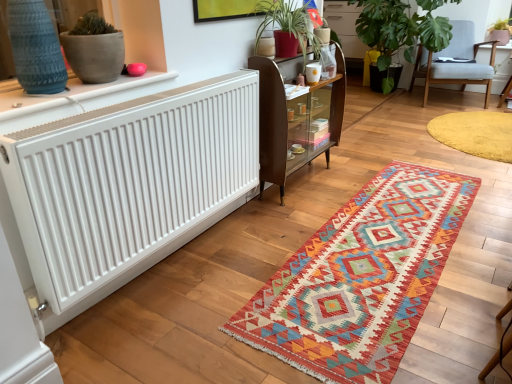
You are a GUI agent. You are given a task and a screenshot of the screen. Output one action in this format:
    pyautogui.click(x=<x>, y=<y>)
    Task: Click on the blank area to the left of yellow plush rug at lower right, the first mat when ordered from back to front
    The width and height of the screenshot is (512, 384).
    Given the screenshot: What is the action you would take?
    pyautogui.click(x=377, y=129)